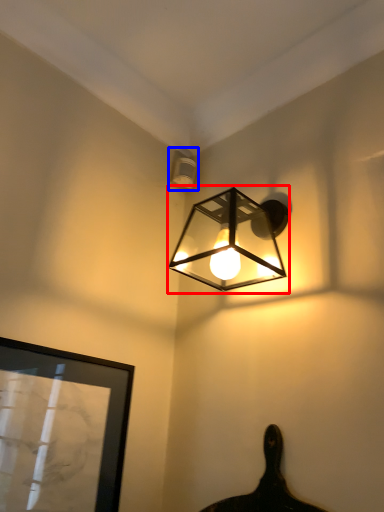
Question: Which object is further to the camera taking this photo, lamp (highlighted by a red box) or lamp (highlighted by a blue box)?

Choices:
 (A) lamp
 (B) lamp

Answer: (B)